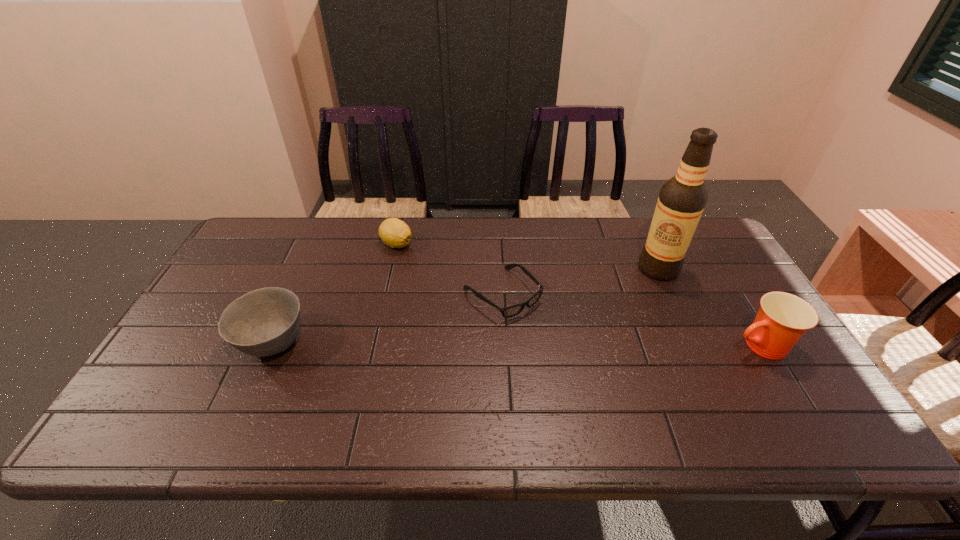
Where is `vacant space at the far left corner of the desktop`? The width and height of the screenshot is (960, 540). vacant space at the far left corner of the desktop is located at coordinates (260, 240).

I want to click on unoccupied area between the third object from right to left and the lemon, so click(x=449, y=269).

In order to click on vacant space that is in between the fourth object from left to right and the farthest object in this screenshot , I will do `click(528, 256)`.

You are a GUI agent. You are given a task and a screenshot of the screen. Output one action in this format:
    pyautogui.click(x=<x>, y=<y>)
    Task: Click on the unoccupied position between the fourth object from left to right and the rightmost object
    The image size is (960, 540).
    Given the screenshot: What is the action you would take?
    pyautogui.click(x=708, y=307)

This screenshot has width=960, height=540. Find the location of `free space that is in between the alcohol and the spectacles`. free space that is in between the alcohol and the spectacles is located at coordinates (580, 281).

This screenshot has height=540, width=960. I want to click on vacant space that's between the fourth object from left to right and the cup, so click(708, 307).

You are a GUI agent. You are given a task and a screenshot of the screen. Output one action in this format:
    pyautogui.click(x=<x>, y=<y>)
    Task: Click on the empty space between the bowl and the second object from left to right
    
    Given the screenshot: What is the action you would take?
    pyautogui.click(x=335, y=294)

Identify the location of vacant space in between the second shortest object and the second object from right to left. point(528,256).

This screenshot has width=960, height=540. I want to click on empty location between the bowl and the second shortest object, so click(x=335, y=294).

You are a GUI agent. You are given a task and a screenshot of the screen. Output one action in this format:
    pyautogui.click(x=<x>, y=<y>)
    Task: Click on the empty location between the farthest object and the tallest object
    
    Given the screenshot: What is the action you would take?
    pyautogui.click(x=528, y=256)